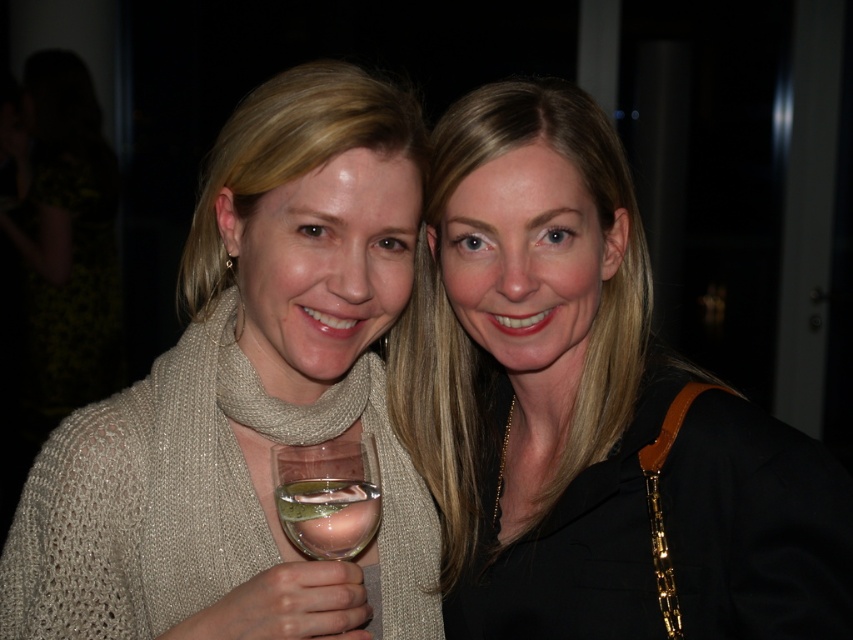
You are standing in front of the two women in the photo. You want to place a small decoration exactly halfway between the point at coordinate (784, 499) and the point at coordinate (370, 573). Will the decoration be closer to the woman on the left or the right?

The decoration placed halfway between point (784, 499) and point (370, 573) will be closer to the woman on the right because point (784, 499) is closer to the viewer than point (370, 573), so the midpoint leans towards the farther point.

You are a photographer setting up for a portrait. You need to ensure that the matte black jacket at center and the clear glass wine at lower center are within a 30 cm distance to frame them together. Based on the scene, can you confirm if they are close enough?

The distance between the matte black jacket at center and the clear glass wine at lower center is 31.62 centimeters, which is slightly more than 30 cm. Therefore, they are not close enough to be framed together within the required distance.

You are a photographer setting up a shot of two women. The scene includes a clear glass wine glass at center and a clear glass wine at lower center. To ensure the wine doesn not spill, how far apart are the two items?

The clear glass wine glass at center and the clear glass wine at lower center are 1.07 inches apart.